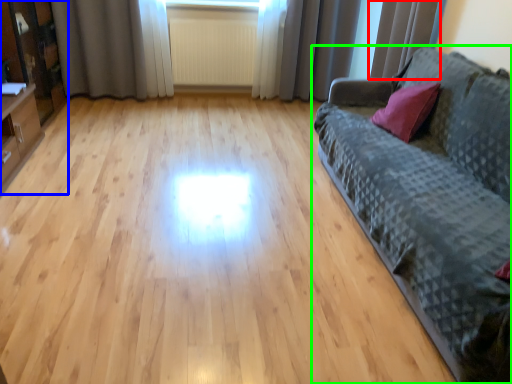
Question: Estimate the real-world distances between objects in this image. Which object is closer to curtain (highlighted by a red box), entertainment center (highlighted by a blue box) or studio couch (highlighted by a green box)?

Choices:
 (A) entertainment center
 (B) studio couch

Answer: (B)